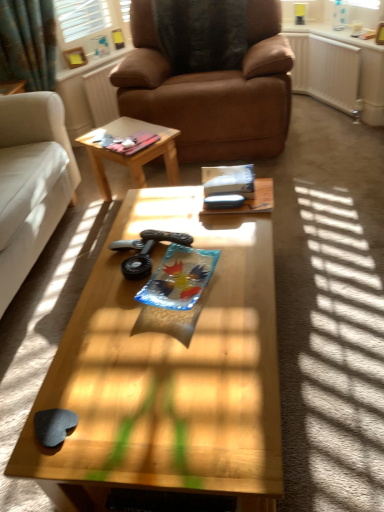
The height and width of the screenshot is (512, 384). I want to click on free point above wooden coffee table at center, acting as the second coffee table starting from the back (from a real-world perspective), so click(174, 290).